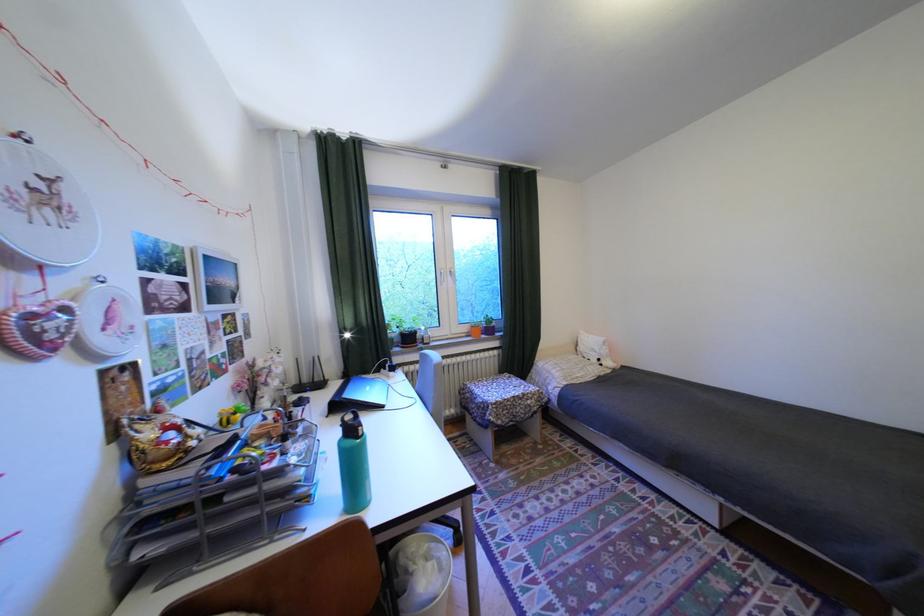
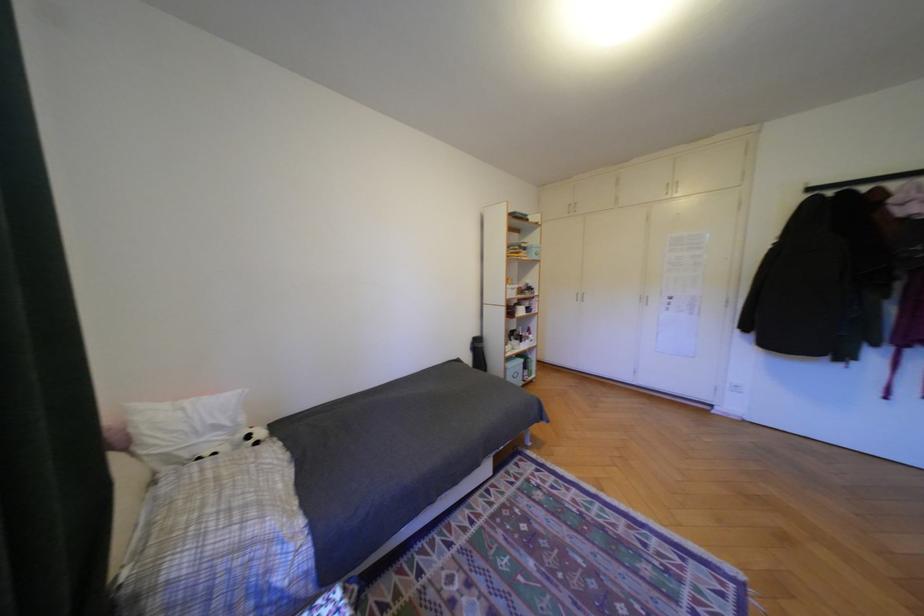
Where in the second image is the point corresponding to point 605,350 from the first image?

(228, 427)